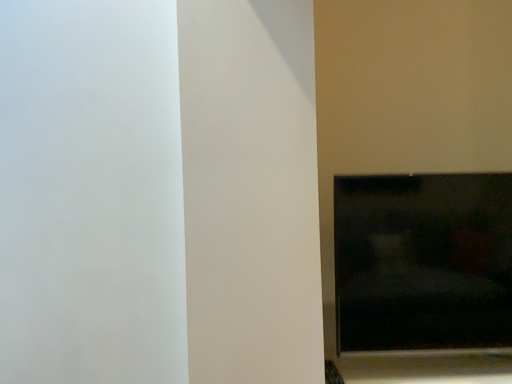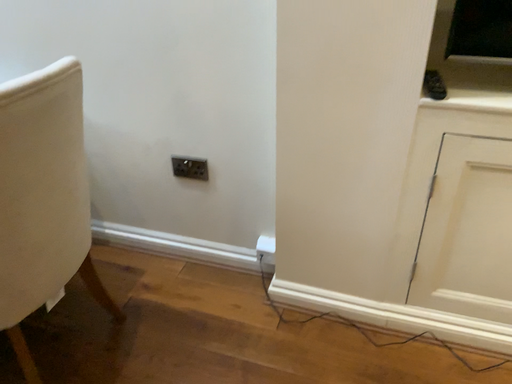
Question: How did the camera likely rotate when shooting the video?

Choices:
 (A) rotated left
 (B) rotated right

Answer: (A)